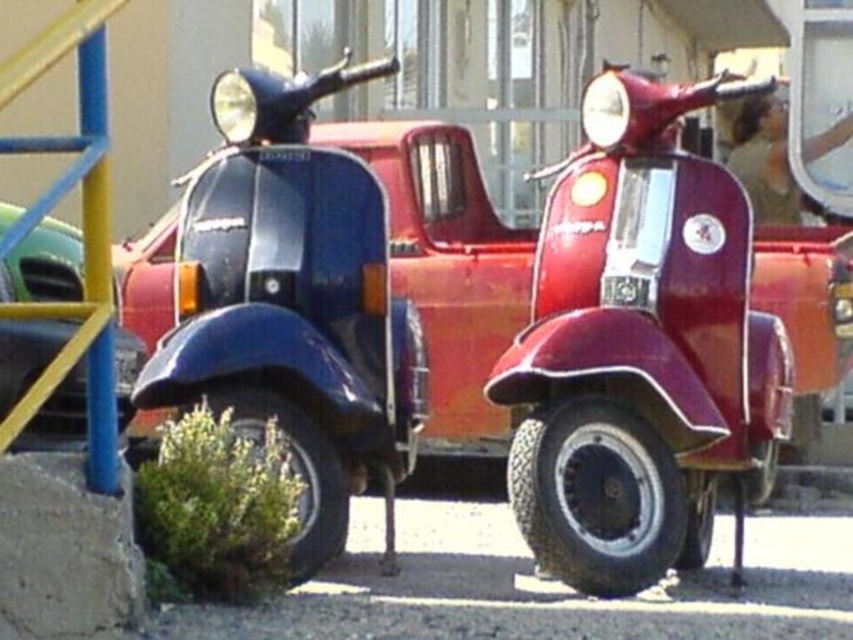
Who is positioned more to the left, glossy blue scooter at center or green matte car at left?

green matte car at left is more to the left.

Between glossy blue scooter at center and green matte car at left, which one is positioned lower?

green matte car at left

Is point (148, 298) positioned before point (67, 332)?

No, it is not.

What are the coordinates of `glossy blue scooter at center` in the screenshot? It's located at (448, 269).

Who is taller, shiny red pickup truck at center or glossy blue scooter at center?

shiny red pickup truck at center is taller.

Is point (664, 344) behind point (421, 196)?

No, (664, 344) is closer to viewer.

This screenshot has height=640, width=853. I want to click on shiny red pickup truck at center, so click(642, 348).

Can you confirm if shiny red pickup truck at center is bigger than green matte car at left?

Yes.

Is point (634, 372) closer to viewer compared to point (45, 410)?

No, (634, 372) is further to viewer.

Identify the location of shiny red pickup truck at center. click(x=642, y=348).